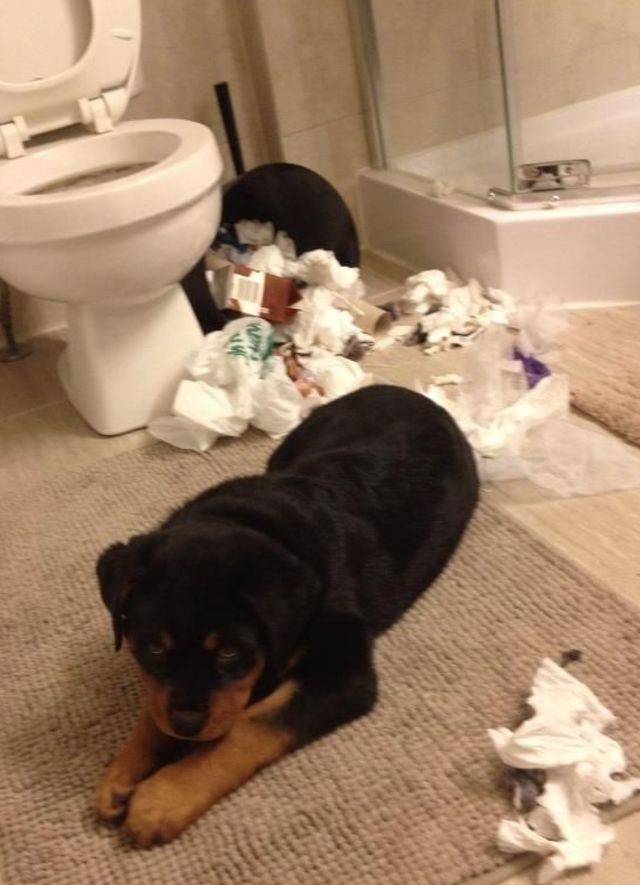
Locate an element on the screen. This screenshot has height=885, width=640. toilet bowl is located at coordinates (127, 274).